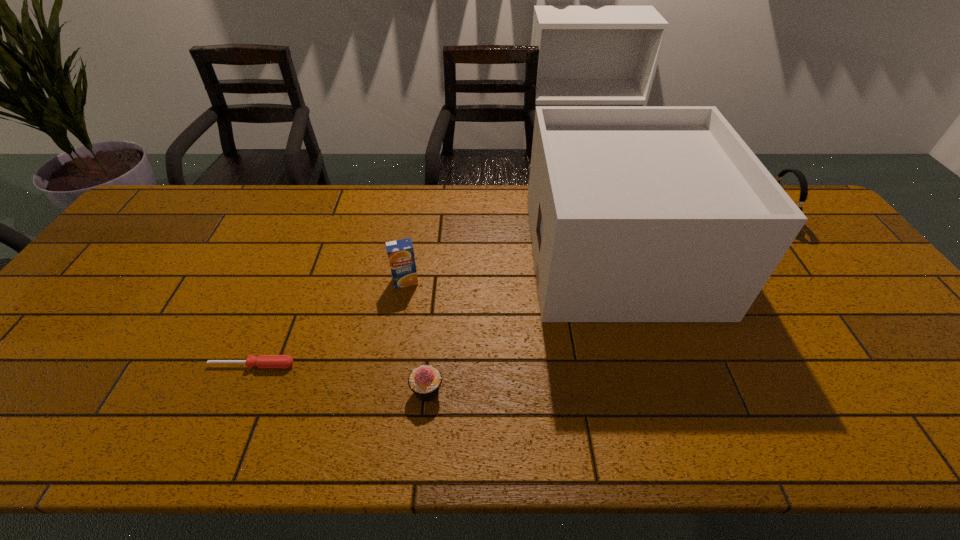
Identify the location of headset positioned at the far edge. The image size is (960, 540). (802, 179).

Locate an element on the screen. The height and width of the screenshot is (540, 960). object that is at the right edge is located at coordinates (802, 179).

The height and width of the screenshot is (540, 960). In order to click on object located at the far right corner in this screenshot , I will do `click(802, 179)`.

The image size is (960, 540). What are the coordinates of `vacant space at the far edge of the desktop` in the screenshot? It's located at (297, 229).

I want to click on vacant space at the near edge, so click(509, 440).

Find the location of `free region at the left edge of the desktop`. free region at the left edge of the desktop is located at coordinates (140, 249).

In order to click on vacant space at the right edge in this screenshot , I will do `click(803, 262)`.

Locate an element on the screen. Image resolution: width=960 pixels, height=540 pixels. empty space that is in between the screwdriver and the orange_juice is located at coordinates (328, 323).

Locate an element on the screen. The image size is (960, 540). empty location between the box and the second object from left to right is located at coordinates (513, 268).

The height and width of the screenshot is (540, 960). Find the location of `free spot between the fourth farthest object and the fourth object from right to left`. free spot between the fourth farthest object and the fourth object from right to left is located at coordinates (328, 323).